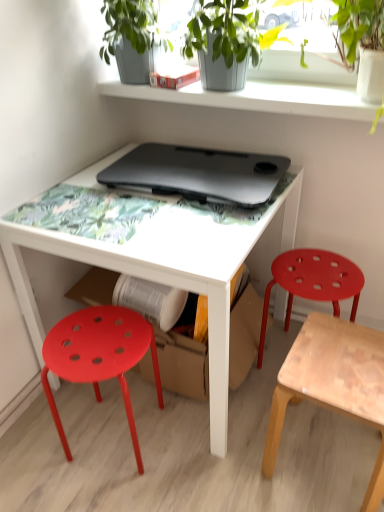
The height and width of the screenshot is (512, 384). I want to click on vacant location below light brown wooden stool at lower right, marked as the 2th stool in a left-to-right arrangement (from a real-world perspective), so click(324, 459).